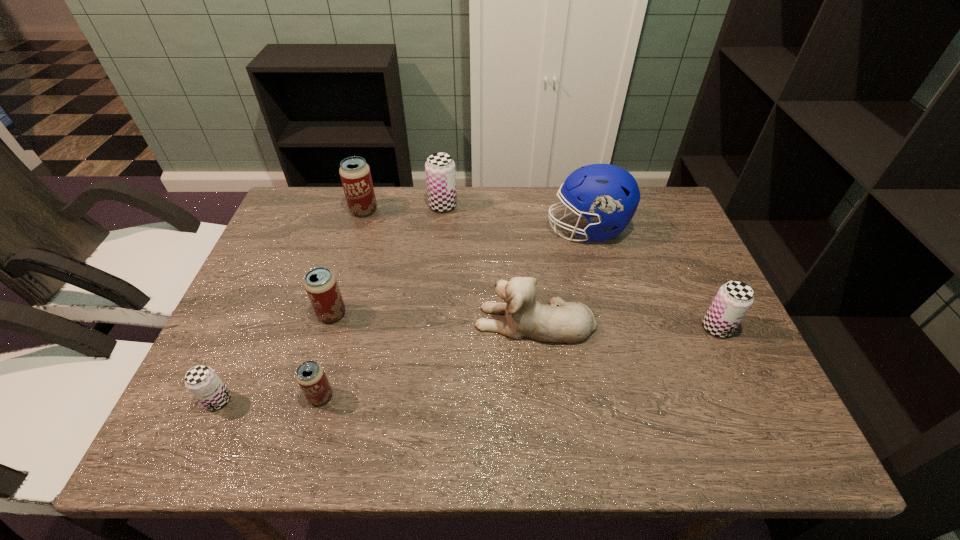
Locate an element on the screen. This screenshot has width=960, height=540. vacant space situated on the back of the second nearest red beer can is located at coordinates (344, 274).

Locate an element on the screen. This screenshot has width=960, height=540. vacant space located on the front of the rightmost purple beer can is located at coordinates (731, 358).

Where is `free space located 0.340m on the back of the nearest purple beer can`? free space located 0.340m on the back of the nearest purple beer can is located at coordinates (276, 274).

Find the location of a particular element. The width and height of the screenshot is (960, 540). vacant area situated on the left of the nearest red beer can is located at coordinates pyautogui.click(x=236, y=396).

At what (x,y) coordinates should I click in order to perform the action: click on football helmet located at the far edge. Please return your answer as a coordinate pair (x, y). The height and width of the screenshot is (540, 960). Looking at the image, I should click on (606, 195).

This screenshot has height=540, width=960. I want to click on object located in the near edge section of the desktop, so point(202,381).

Locate an element on the screen. object that is at the left edge is located at coordinates (202, 381).

Find the location of `football helmet situated at the right edge`. football helmet situated at the right edge is located at coordinates (606, 195).

Locate an element on the screen. The height and width of the screenshot is (540, 960). beer can located in the right edge section of the desktop is located at coordinates (733, 300).

Find the location of a particular element. The image size is (960, 540). object situated at the near left corner is located at coordinates (202, 381).